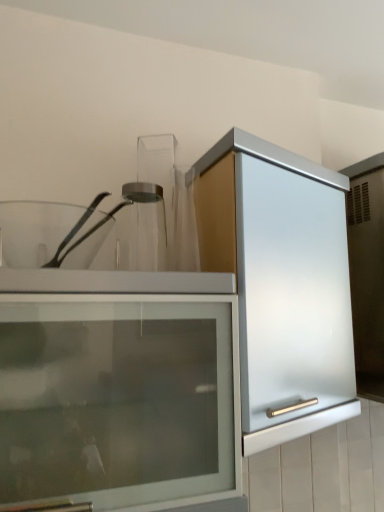
Question: From a real-world perspective, relative to clear glass jar at center, is satin silver cabinet at center vertically above or below?

Choices:
 (A) above
 (B) below

Answer: (B)

Question: From the image's perspective, is satin silver cabinet at center positioned above or below clear glass jar at center?

Choices:
 (A) below
 (B) above

Answer: (A)

Question: Based on their positions, is satin silver cabinet at center located to the left or right of clear glass jar at center?

Choices:
 (A) left
 (B) right

Answer: (B)

Question: From a real-world perspective, is clear glass jar at center positioned above or below satin silver cabinet at center?

Choices:
 (A) above
 (B) below

Answer: (A)

Question: Which is correct: clear glass jar at center is inside satin silver cabinet at center, or outside of it?

Choices:
 (A) inside
 (B) outside

Answer: (B)

Question: Based on their sizes in the image, would you say clear glass jar at center is bigger or smaller than satin silver cabinet at center?

Choices:
 (A) big
 (B) small

Answer: (B)

Question: Based on their positions, is clear glass jar at center located to the left or right of satin silver cabinet at center?

Choices:
 (A) left
 (B) right

Answer: (A)